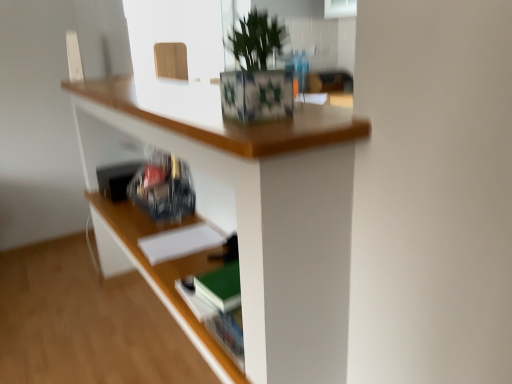
Question: From the image's perspective, is wooden frame at upper center above or below wooden desk at upper center?

Choices:
 (A) below
 (B) above

Answer: (B)

Question: In terms of height, does wooden frame at upper center look taller or shorter compared to wooden desk at upper center?

Choices:
 (A) short
 (B) tall

Answer: (A)

Question: Based on their relative distances, which object is nearer to the wooden frame at upper center?

Choices:
 (A) green leafy plant at upper center
 (B) white matte paper at center
 (C) wooden desk at upper center

Answer: (C)

Question: Which of these objects is positioned farthest from the wooden frame at upper center?

Choices:
 (A) green leafy plant at upper center
 (B) wooden desk at upper center
 (C) white matte paper at center

Answer: (A)